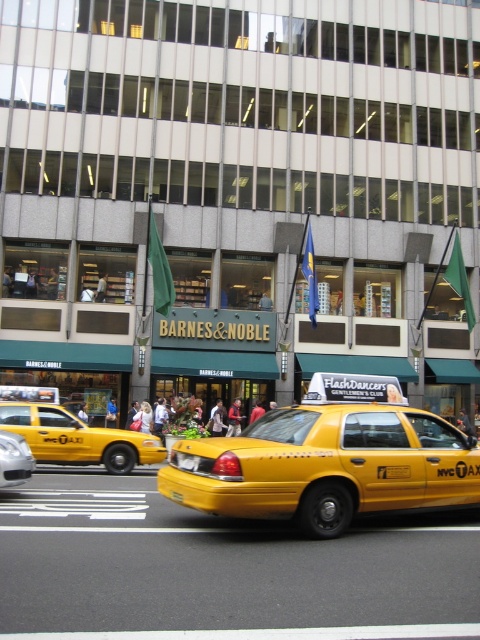
Does yellow matte taxi at center have a larger size compared to silver metallic sedan at center?

No.

Does yellow matte taxi at center appear under silver metallic sedan at center?

Actually, yellow matte taxi at center is above silver metallic sedan at center.

This screenshot has width=480, height=640. What are the coordinates of `yellow matte taxi at center` in the screenshot? It's located at (328, 460).

Where is `yellow matte taxi at center`? yellow matte taxi at center is located at coordinates (328, 460).

Does yellow rubber taxi cab at center have a smaller size compared to silver metallic sedan at center?

No, yellow rubber taxi cab at center is not smaller than silver metallic sedan at center.

Is point (95, 452) farther from camera compared to point (15, 458)?

Yes, point (95, 452) is farther from viewer.

What do you see at coordinates (78, 438) in the screenshot? I see `yellow rubber taxi cab at center` at bounding box center [78, 438].

Image resolution: width=480 pixels, height=640 pixels. Find the location of `yellow rubber taxi cab at center`. yellow rubber taxi cab at center is located at coordinates (78, 438).

Who is positioned more to the left, yellow matte taxi at center or yellow rubber taxi cab at center?

yellow rubber taxi cab at center is more to the left.

Between point (386, 392) and point (84, 464), which one is positioned behind?

Point (84, 464)

The image size is (480, 640). Identify the location of yellow matte taxi at center. (328, 460).